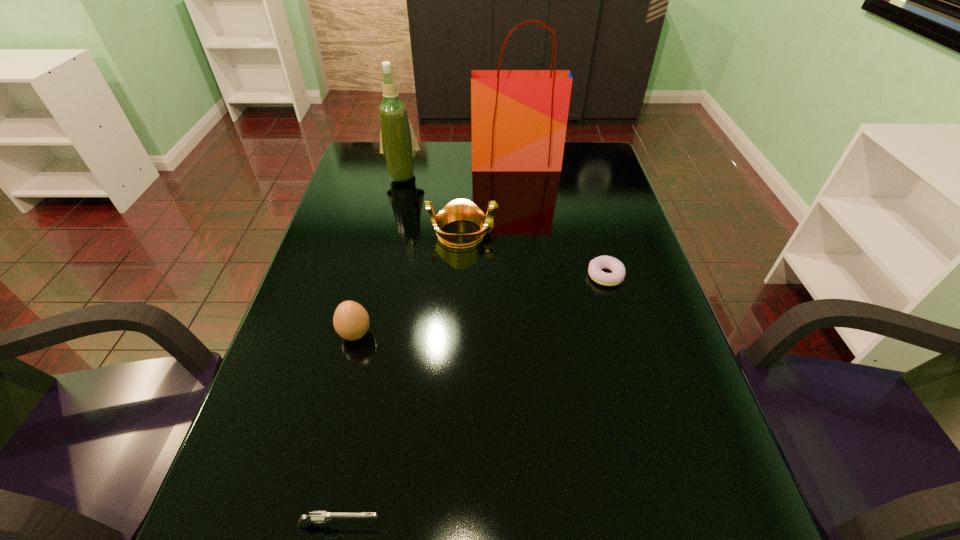
Identify the location of object at the far left corner. (398, 143).

Identify the location of vacant space at the far edge of the desktop. (497, 176).

In the image, there is a desktop. Identify the location of vacant space at the left edge. (235, 524).

Identify the location of vacant position at the right edge of the desktop. Image resolution: width=960 pixels, height=540 pixels. (685, 373).

The height and width of the screenshot is (540, 960). What are the coordinates of `blank area at the far left corner` in the screenshot? It's located at (361, 177).

This screenshot has height=540, width=960. In the image, there is a desktop. Identify the location of free space at the far right corner. (574, 170).

The width and height of the screenshot is (960, 540). I want to click on free area in between the tiara and the doughnut, so click(534, 254).

Image resolution: width=960 pixels, height=540 pixels. Identify the location of vacant point located between the tiara and the third nearest object. (534, 254).

You are a GUI agent. You are given a task and a screenshot of the screen. Output one action in this format:
    pyautogui.click(x=<x>, y=<y>)
    Task: Click on the vacant area that lies between the tiara and the shopping bag
    
    Given the screenshot: What is the action you would take?
    pyautogui.click(x=489, y=198)

This screenshot has width=960, height=540. Identify the location of free area in between the boiled egg and the tallest object. (436, 248).